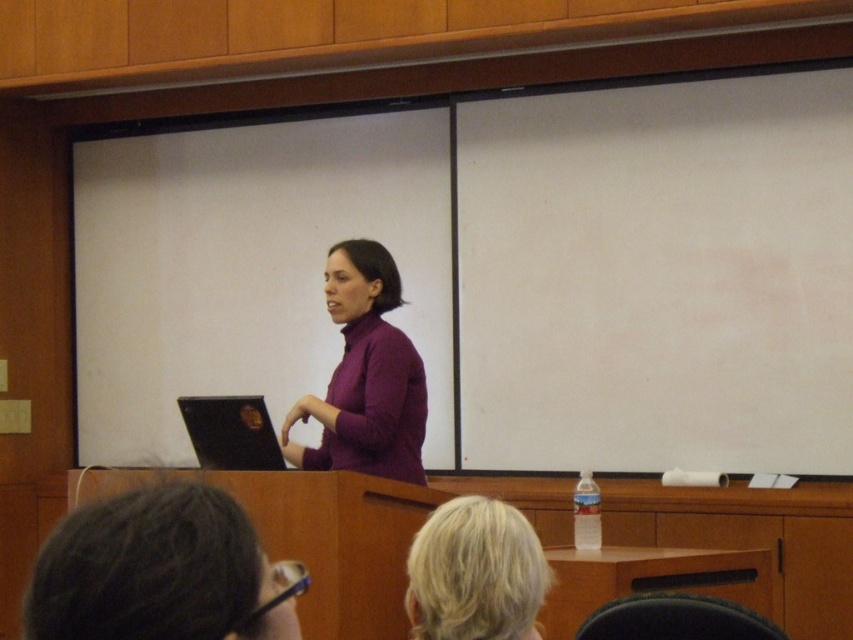
Who is positioned more to the left, purple matte sweater at center or blonde hair at upper center?

Positioned to the left is purple matte sweater at center.

Does purple matte sweater at center lie in front of blonde hair at upper center?

No, purple matte sweater at center is further to the viewer.

Measure the distance between point (422, 400) and camera.

The distance of point (422, 400) from camera is 11.28 feet.

This screenshot has width=853, height=640. I want to click on purple matte sweater at center, so click(x=364, y=376).